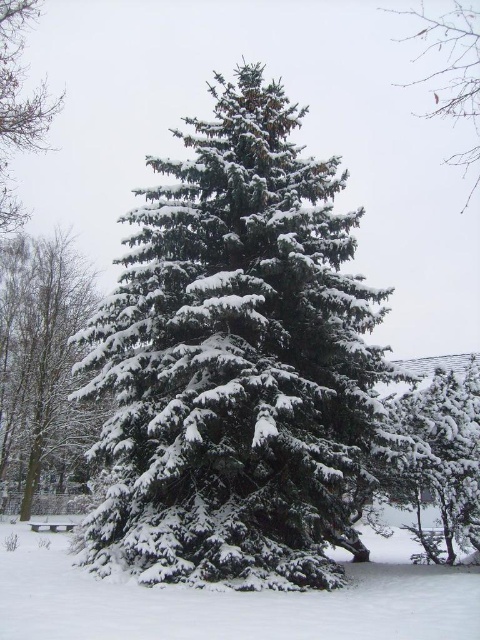
You are an artist sketching this winter scene. You want to ensure the green matte pine tree at upper right and the green matte tree at upper left are proportionally accurate. Which of the two trees should you draw larger in your sketch?

The green matte pine tree at upper right should be drawn larger than the green matte tree at upper left because it has a larger size compared to it according to the description.

You are standing in the winter scene and want to walk from the point at coordinates point (476, 125) to the point at coordinates point (12, 113). Which direction should you move to get closer to your destination?

You should move downward because point (12, 113) is located below point (476, 125) in the image.